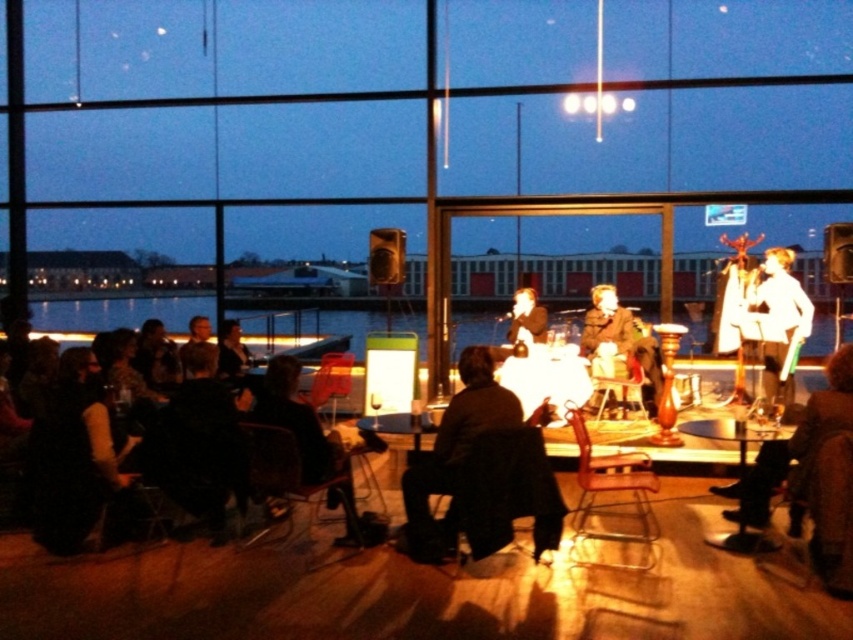
Question: Does dark fabric dress at left have a lesser width compared to matte brown suit at center?

Choices:
 (A) yes
 (B) no

Answer: (B)

Question: Can you confirm if dark fabric dress at left is positioned to the left of smooth black suit at center?

Choices:
 (A) no
 (B) yes

Answer: (B)

Question: Which is farther from the dark brown leather jacket at center?

Choices:
 (A) dark fabric dress at left
 (B) smooth black suit at center
 (C) white glossy shirt at center
 (D) leather jacket at lower right

Answer: (C)

Question: Does dark brown leather jacket at center come behind matte brown suit at center?

Choices:
 (A) yes
 (B) no

Answer: (B)

Question: Which point is farther to the camera?

Choices:
 (A) (486, 358)
 (B) (611, 371)
 (C) (508, 339)

Answer: (C)

Question: Which point is closer to the camera?

Choices:
 (A) pos(848,401)
 (B) pos(202,349)
 (C) pos(495,387)

Answer: (A)